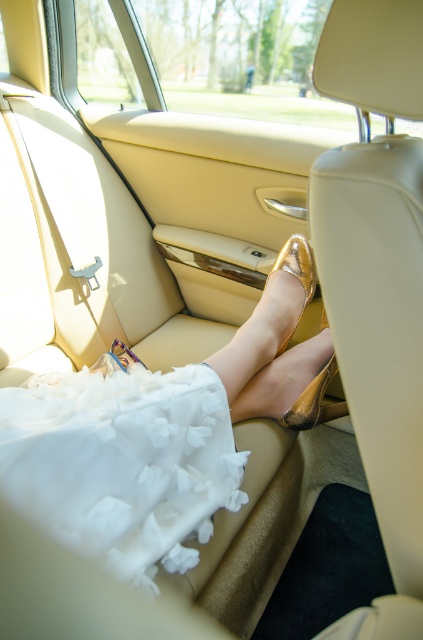
You are a car seat designer checking the space between the metallic gold shoe at center and the white fluffy dress at lower left. Based on the image, do you think the space between them is sufficient for a 10 cm wide seat cushion?

The metallic gold shoe at center might be wider than white fluffy dress at lower left, so the space between them may not be sufficient for a 10 cm wide seat cushion.

You are a delivery robot trying to place a package in the car. The package must be placed at point (51, 506). The robot has a 36 inch arm. Can the robot reach the point?

The distance between point (51, 506) and the camera is 36.29 inches. The robot has a 36 inch arm, so it cannot reach the point because the distance is slightly longer than the arm length.

You are a delivery person trying to place a small package between the metallic gold shoe at center and the seatbelt buckle on the left. Can you fit the package there?

The metallic gold shoe at center and the seatbelt buckle on the left are 29.71 inches apart, so yes, the package can fit between them since the distance is sufficient.